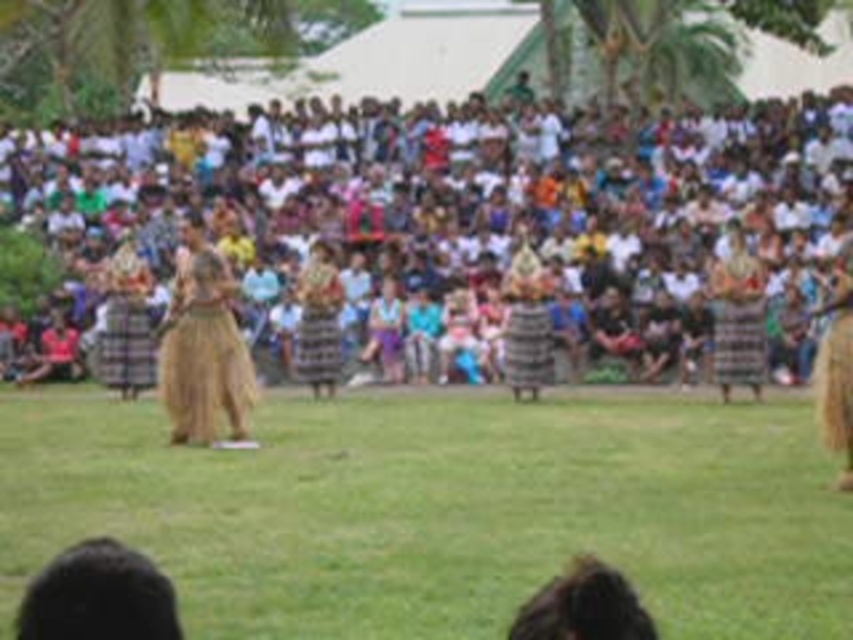
You are a photographer at the event and want to capture a photo of the textured brown skirt at right without the green grass at center showing in the background. Is this possible based on their positions?

The green grass at center is located below the textured brown skirt at right, so if you position the camera to focus on the skirt and avoid framing the area below it, the grass can be excluded from the shot.

You are a photographer at the event and want to capture both the brown woven skirt at center and the brown woven skirt at right in a single shot. Which direction should you position yourself relative to the skirts to ensure both are in frame?

You should position yourself to the left of both the brown woven skirt at center and the brown woven skirt at right to include both in the frame, as the brown woven skirt at center is to the left of the brown woven skirt at right.